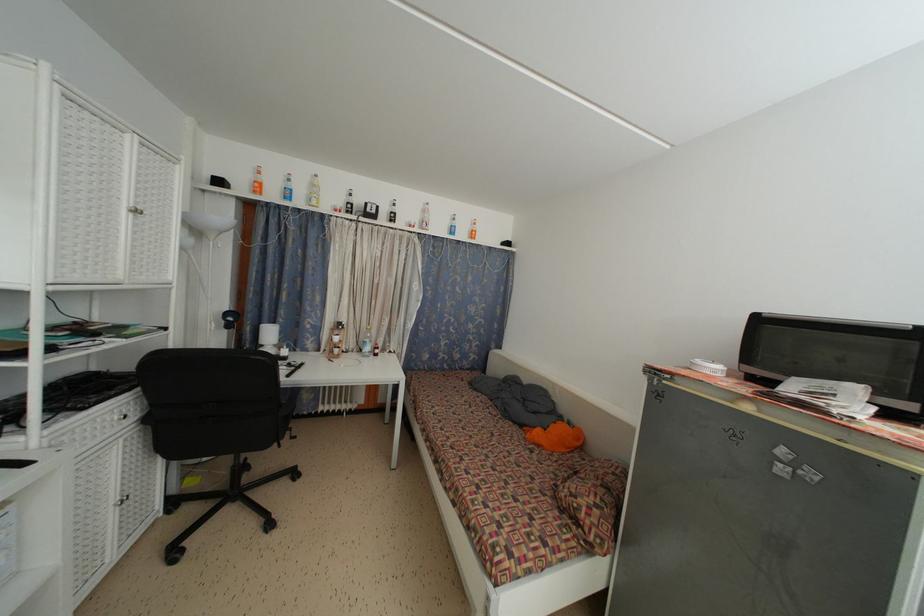
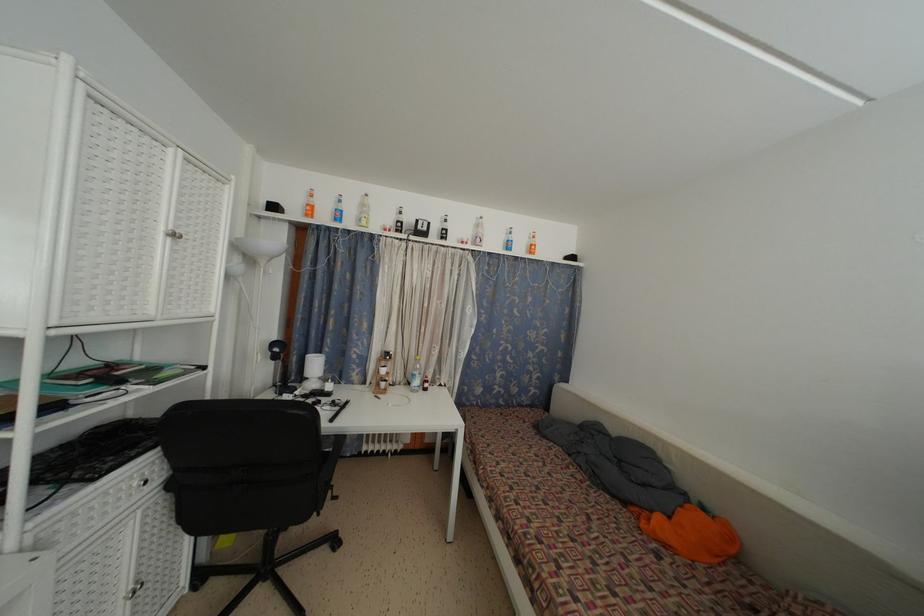
Locate, in the second image, the point that corresponds to [292,439] in the first image.

(333, 498)